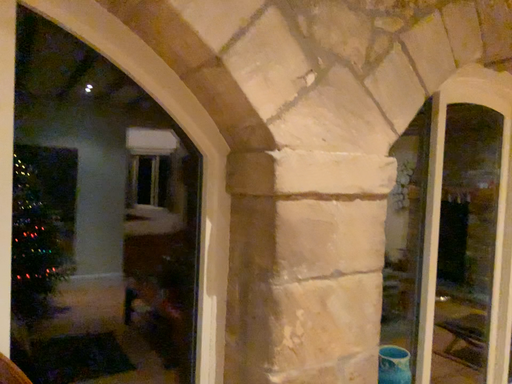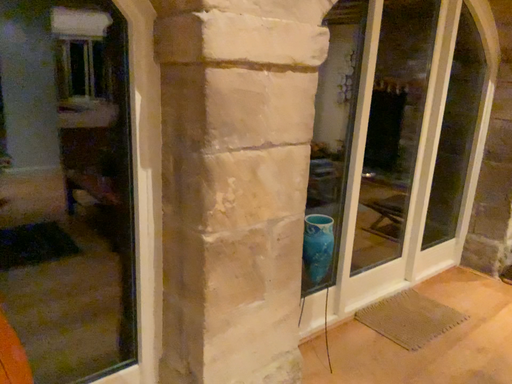
Question: Which way did the camera rotate in the video?

Choices:
 (A) rotated left
 (B) rotated right

Answer: (B)